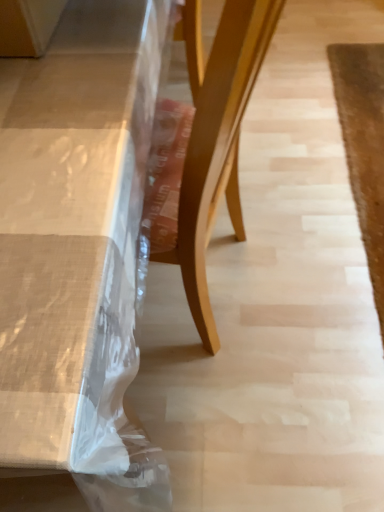
Image resolution: width=384 pixels, height=512 pixels. Identify the location of matte plastic table at lower left. (78, 245).

What is the approximate width of matte plastic table at lower left?

It is 35.36 inches.

This screenshot has width=384, height=512. What do you see at coordinates (78, 245) in the screenshot?
I see `matte plastic table at lower left` at bounding box center [78, 245].

You are a GUI agent. You are given a task and a screenshot of the screen. Output one action in this format:
    pyautogui.click(x=<x>, y=<y>)
    Task: Click on the matte plastic table at lower left
    The image size is (384, 512).
    Given the screenshot: What is the action you would take?
    pyautogui.click(x=78, y=245)